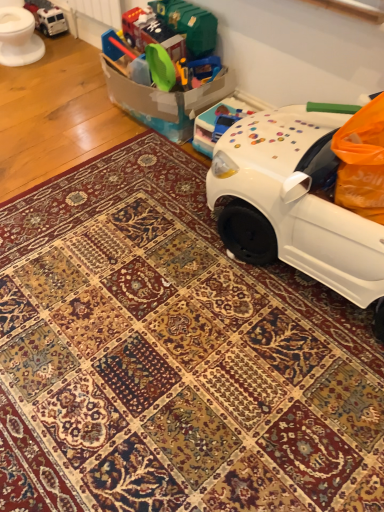
Identify the location of free spot above translucent plastic toy car at upper right, acting as the 2th toy starting from the top (from a real-world perspective). coord(217,102).